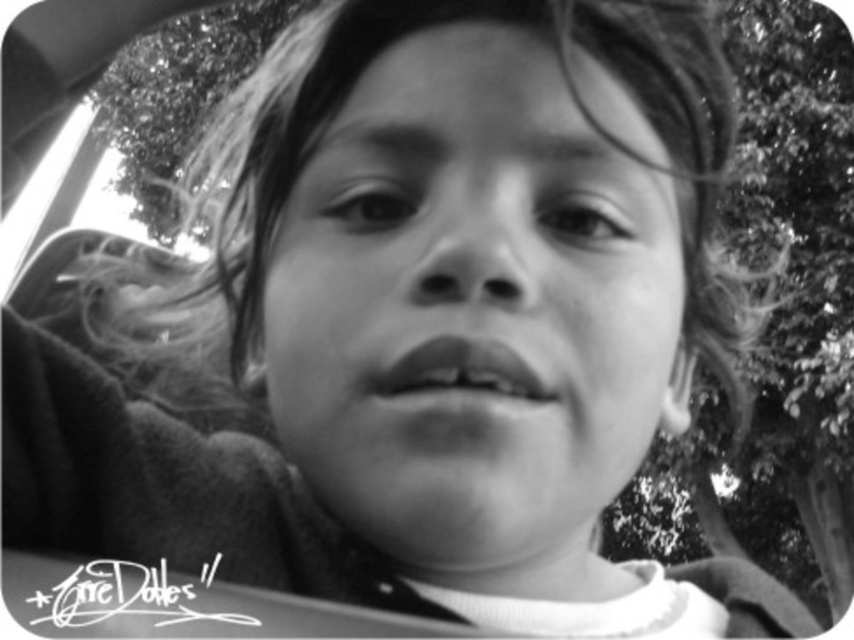
From the picture: You are a photographer adjusting the focus on a camera. The subject is a child in a car with their face at the center. You notice the smooth skin face at center and the blurred greenery outside the vehicle. How far apart are these two elements in the image?

The smooth skin face at center and the blurred greenery outside the vehicle are 26.01 centimeters apart.

You are a photographer adjusting the focus on a camera lens. The subject is the child in the image, and you need to ensure both the smooth skin face at center and the smooth skin lips at center are in focus. Given that the depth of field can cover 2.5 inches, will both areas be in focus?

The smooth skin face at center and smooth skin lips at center are 2.29 inches apart, which is within the 2.5 inch depth of field, so both areas will be in focus.

Based on the scene description, where are the smooth skin lips at center positioned relative to the smooth skin face at center?

The smooth skin lips at center are positioned below the smooth skin face at center since the face is above them.